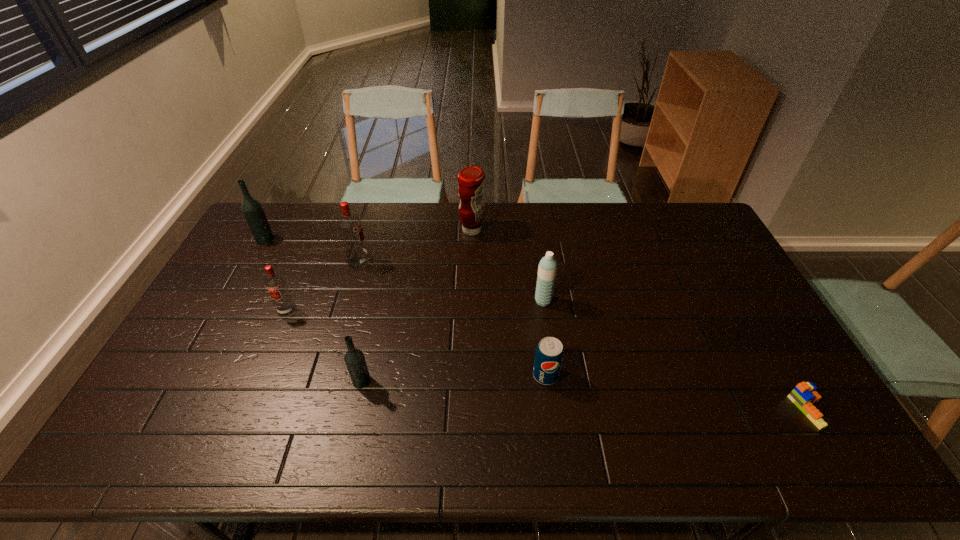
Find the location of a particular element. The height and width of the screenshot is (540, 960). the fifth object from left to right is located at coordinates (471, 179).

I want to click on condiment, so click(471, 179).

The image size is (960, 540). I want to click on the leftmost vodka, so click(252, 209).

The height and width of the screenshot is (540, 960). I want to click on the farther black vodka, so click(252, 209).

Image resolution: width=960 pixels, height=540 pixels. I want to click on the sixth nearest object, so click(349, 225).

Find the location of a particular element. the sixth object from right to left is located at coordinates (349, 225).

Identify the location of blue water bottle. (547, 269).

Find the location of a particular element. the second nearest vodka is located at coordinates (275, 284).

The height and width of the screenshot is (540, 960). I want to click on the second object from left to right, so click(275, 284).

Find the location of a particular element. This screenshot has width=960, height=540. the fourth object from left to right is located at coordinates (354, 358).